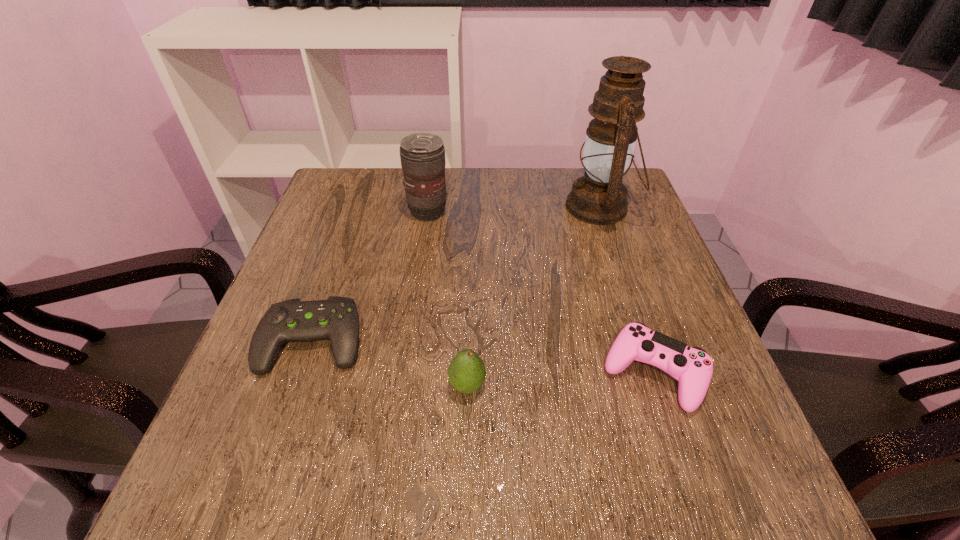
Find the location of a particular element. vacant space at the far edge of the desktop is located at coordinates (461, 199).

Locate an element on the screen. The width and height of the screenshot is (960, 540). free location at the near edge is located at coordinates (406, 480).

This screenshot has height=540, width=960. Identify the location of free space at the left edge. (298, 414).

Where is `free space at the right edge of the desktop`? The height and width of the screenshot is (540, 960). free space at the right edge of the desktop is located at coordinates click(636, 314).

The height and width of the screenshot is (540, 960). In order to click on vacant space at the far right corner in this screenshot , I will do `click(645, 212)`.

Find the location of a particular element. Image resolution: width=960 pixels, height=540 pixels. vacant region at the near right corner of the desktop is located at coordinates (774, 484).

Identify the location of empty location between the third object from right to left and the telephoto lens. The width and height of the screenshot is (960, 540). point(447,299).

I want to click on vacant space that is in between the tallest object and the fourth object from right to left, so click(x=514, y=209).

Locate an element on the screen. free spot between the fourth object from right to left and the tallest object is located at coordinates (514, 209).

This screenshot has height=540, width=960. Find the location of `free space between the shortest object and the third object from left to right`. free space between the shortest object and the third object from left to right is located at coordinates (390, 363).